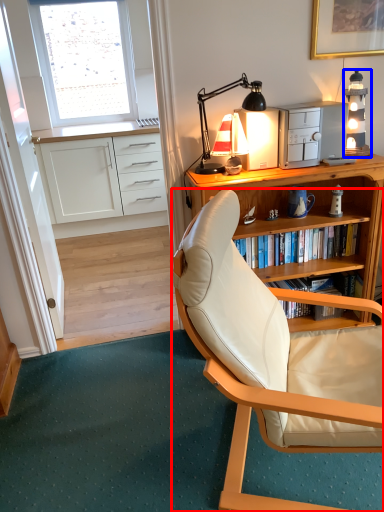
Question: Which of the following is the farthest to the observer, chair (highlighted by a red box) or lamp (highlighted by a blue box)?

Choices:
 (A) chair
 (B) lamp

Answer: (B)